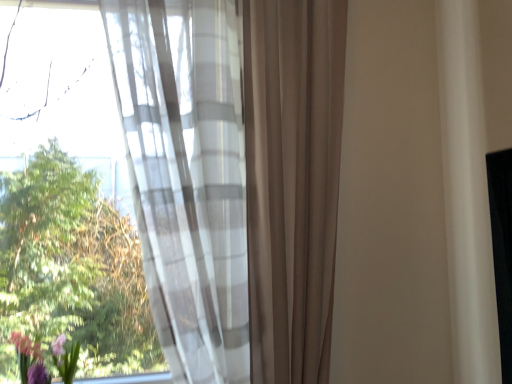
Question: Is purple matte floral arrangement at lower left at the right side of sheer white curtain at left?

Choices:
 (A) no
 (B) yes

Answer: (A)

Question: Can you confirm if purple matte floral arrangement at lower left is wider than sheer white curtain at left?

Choices:
 (A) no
 (B) yes

Answer: (A)

Question: Is purple matte floral arrangement at lower left positioned beyond the bounds of sheer white curtain at left?

Choices:
 (A) no
 (B) yes

Answer: (B)

Question: Does purple matte floral arrangement at lower left come in front of sheer white curtain at left?

Choices:
 (A) yes
 (B) no

Answer: (B)

Question: Does purple matte floral arrangement at lower left have a greater height compared to sheer white curtain at left?

Choices:
 (A) no
 (B) yes

Answer: (A)

Question: Is purple matte floral arrangement at lower left at the left side of sheer white curtain at left?

Choices:
 (A) yes
 (B) no

Answer: (A)

Question: From a real-world perspective, is sheer white curtain at left located higher than purple matte floral arrangement at lower left?

Choices:
 (A) yes
 (B) no

Answer: (A)

Question: Is purple matte floral arrangement at lower left at the back of sheer white curtain at left?

Choices:
 (A) no
 (B) yes

Answer: (A)

Question: Is sheer white curtain at left thinner than purple matte floral arrangement at lower left?

Choices:
 (A) yes
 (B) no

Answer: (B)

Question: From the image's perspective, would you say sheer white curtain at left is shown under purple matte floral arrangement at lower left?

Choices:
 (A) yes
 (B) no

Answer: (B)

Question: Is the surface of sheer white curtain at left in direct contact with purple matte floral arrangement at lower left?

Choices:
 (A) yes
 (B) no

Answer: (B)

Question: Is sheer white curtain at left further to camera compared to purple matte floral arrangement at lower left?

Choices:
 (A) yes
 (B) no

Answer: (B)

Question: From the image's perspective, relative to purple matte floral arrangement at lower left, is sheer white curtain at left above or below?

Choices:
 (A) above
 (B) below

Answer: (A)